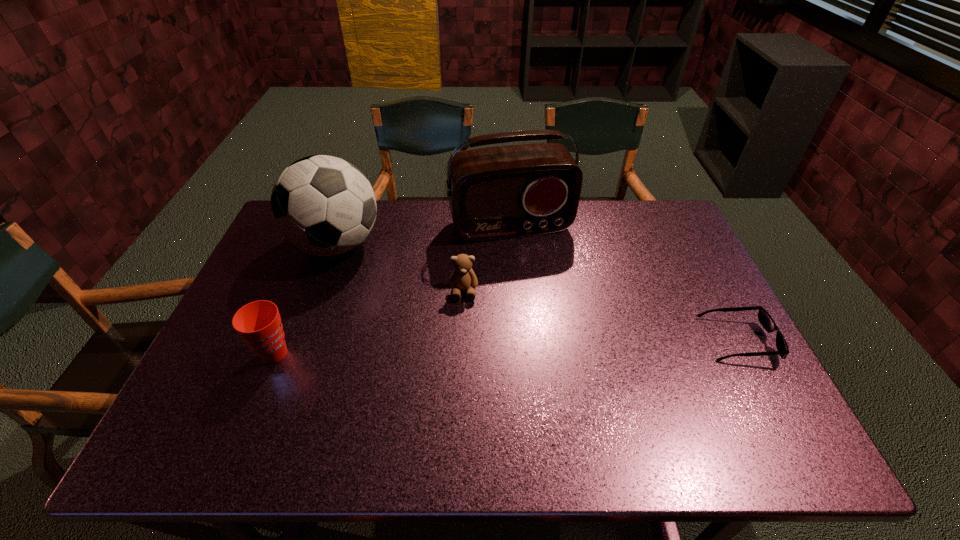
What are the coordinates of `free spot between the soccer ball and the second shortest object` in the screenshot? It's located at coord(400,268).

Locate an element on the screen. vacant area that lies between the shortest object and the third farthest object is located at coordinates (601, 316).

I want to click on empty location between the radio receiver and the soccer ball, so click(423, 235).

Locate an element on the screen. The height and width of the screenshot is (540, 960). free space between the soccer ball and the teddy bear is located at coordinates (400, 268).

I want to click on free area in between the sunglasses and the radio receiver, so click(x=624, y=284).

The height and width of the screenshot is (540, 960). Identify the location of vacant area between the shortest object and the radio receiver. (624, 284).

The image size is (960, 540). Find the location of `free point between the sunglasses and the third nearest object`. free point between the sunglasses and the third nearest object is located at coordinates (601, 316).

At what (x,y) coordinates should I click in order to perform the action: click on free space between the soccer ball and the radio receiver. Please return your answer as a coordinate pair (x, y). The width and height of the screenshot is (960, 540). Looking at the image, I should click on (423, 235).

Image resolution: width=960 pixels, height=540 pixels. What are the coordinates of `object that is the second nearest to the radio receiver` in the screenshot? It's located at (322, 205).

The image size is (960, 540). What are the coordinates of `object that stands as the closest to the soccer ball` in the screenshot? It's located at (501, 192).